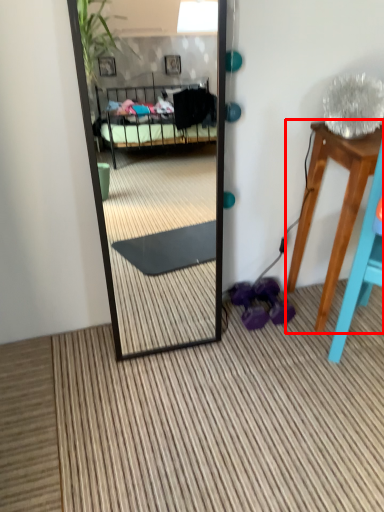
Question: Observing the image, what is the correct spatial positioning of table (annotated by the red box) in reference to shoe?

Choices:
 (A) left
 (B) right

Answer: (B)